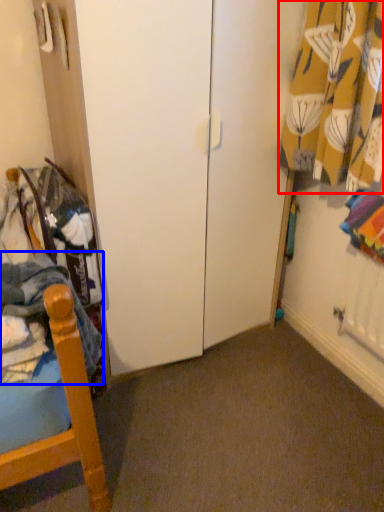
Question: Which of the following is the closest to the observer, curtain (highlighted by a red box) or clothing (highlighted by a blue box)?

Choices:
 (A) curtain
 (B) clothing

Answer: (B)